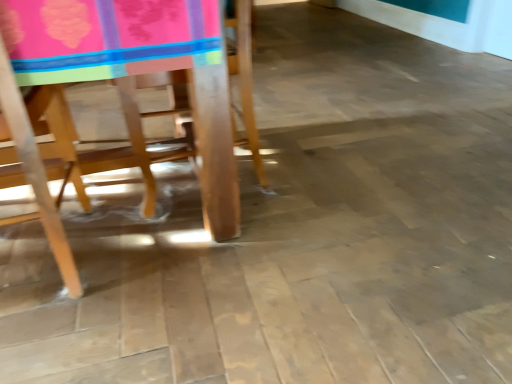
Question: Would you say wooden chair at left, which appears as the 1th chair when viewed from the right, contains wooden chair at left, positioned as the 2th chair in right-to-left order?

Choices:
 (A) no
 (B) yes

Answer: (B)

Question: Is wooden chair at left, the 2th chair from the left, oriented towards wooden chair at left, the 1th chair from the left?

Choices:
 (A) no
 (B) yes

Answer: (B)

Question: Does wooden chair at left, which appears as the 1th chair when viewed from the right, appear on the right side of wooden chair at left, the 1th chair from the left?

Choices:
 (A) yes
 (B) no

Answer: (A)

Question: Can you confirm if wooden chair at left, which appears as the 1th chair when viewed from the right, is taller than wooden chair at left, positioned as the 2th chair in right-to-left order?

Choices:
 (A) no
 (B) yes

Answer: (A)

Question: Does wooden chair at left, which appears as the 1th chair when viewed from the right, have a larger size compared to wooden chair at left, positioned as the 2th chair in right-to-left order?

Choices:
 (A) no
 (B) yes

Answer: (B)

Question: Can you confirm if wooden chair at left, the 2th chair from the left, is shorter than wooden chair at left, positioned as the 2th chair in right-to-left order?

Choices:
 (A) yes
 (B) no

Answer: (A)

Question: Could you tell me if wooden chair at left, positioned as the 2th chair in right-to-left order, is facing wooden chair at left, the 2th chair from the left?

Choices:
 (A) no
 (B) yes

Answer: (B)

Question: Does wooden chair at left, positioned as the 2th chair in right-to-left order, have a greater height compared to wooden chair at left, the 2th chair from the left?

Choices:
 (A) yes
 (B) no

Answer: (A)

Question: Is wooden chair at left, the 1th chair from the left, at the left side of wooden chair at left, the 2th chair from the left?

Choices:
 (A) no
 (B) yes

Answer: (B)

Question: Considering the relative sizes of wooden chair at left, the 1th chair from the left, and wooden chair at left, which appears as the 1th chair when viewed from the right, in the image provided, is wooden chair at left, the 1th chair from the left, smaller than wooden chair at left, which appears as the 1th chair when viewed from the right,?

Choices:
 (A) yes
 (B) no

Answer: (A)

Question: Does wooden chair at left, positioned as the 2th chair in right-to-left order, have a lesser width compared to wooden chair at left, the 2th chair from the left?

Choices:
 (A) no
 (B) yes

Answer: (B)

Question: From the image's perspective, is wooden chair at left, positioned as the 2th chair in right-to-left order, on top of wooden chair at left, the 2th chair from the left?

Choices:
 (A) no
 (B) yes

Answer: (A)

Question: From the image's perspective, is wooden chair at left, which appears as the 1th chair when viewed from the right, positioned above or below wooden chair at left, positioned as the 2th chair in right-to-left order?

Choices:
 (A) below
 (B) above

Answer: (B)